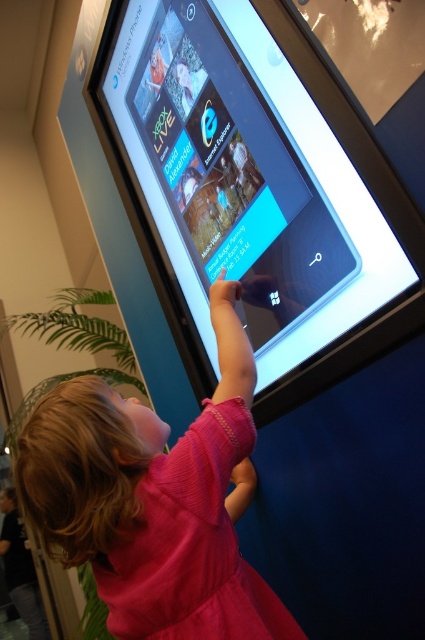
Based on the photo, you are standing in front of the touchscreen display and want to reach the point at coordinates (340, 225). If your arm can extend 36 inches, will you be able to reach it?

The distance between the point at coordinates (340, 225) and the camera is 37.43 inches. Since your arm can only extend 36 inches, you will not be able to reach it.

You are a security guard in the room. You notice the matte black touchscreen at upper center and the pink fabric dress at center. Which object is closer to you?

The matte black touchscreen at upper center is closer to you because it is in front of the pink fabric dress at center.